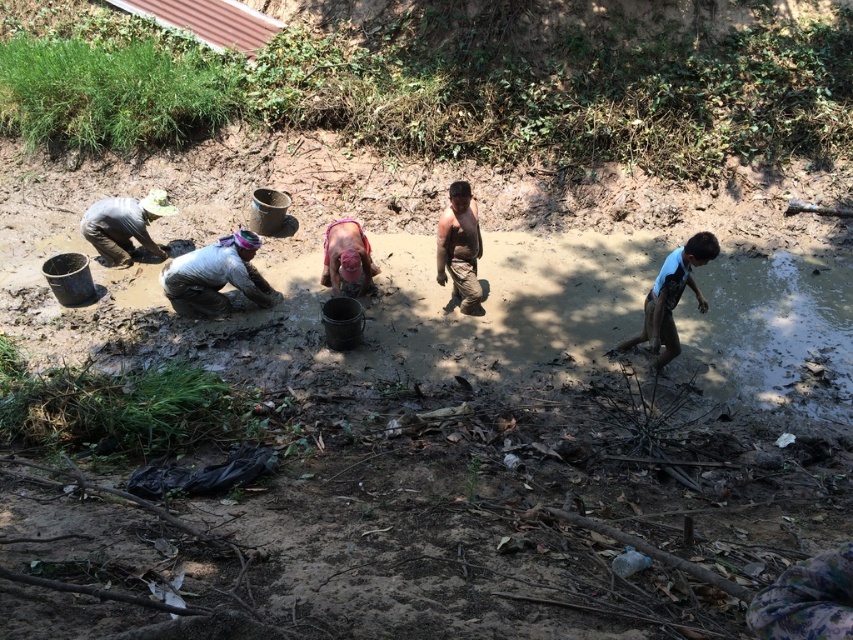
Question: Which object is farther from the camera taking this photo?

Choices:
 (A) bare skin/rough skin man at center
 (B) pink fabric mask at center
 (C) light brown fabric shirt at center

Answer: (B)

Question: Which point is closer to the camera?

Choices:
 (A) dark gray fabric shirt at left
 (B) pink fabric mask at center

Answer: (B)

Question: Can you confirm if bare skin/rough skin man at center is wider than pink fabric mask at center?

Choices:
 (A) no
 (B) yes

Answer: (A)

Question: Can you confirm if blue matte shirt at right is wider than dark gray fabric shirt at left?

Choices:
 (A) yes
 (B) no

Answer: (B)

Question: Does light brown fabric shirt at center have a smaller size compared to blue matte shirt at right?

Choices:
 (A) no
 (B) yes

Answer: (B)

Question: Based on their relative distances, which object is nearer to the blue matte shirt at right?

Choices:
 (A) pink fabric mask at center
 (B) light brown fabric shirt at center
 (C) bare skin/rough skin man at center

Answer: (C)